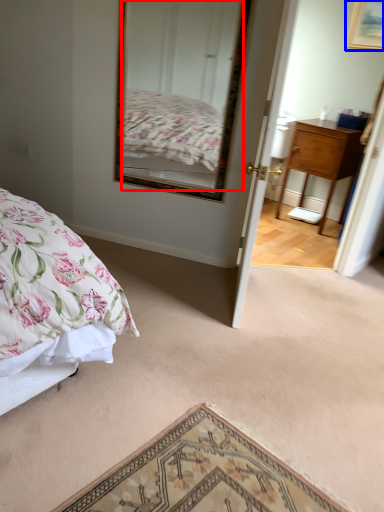
Question: Which of the following is the farthest to the observer, mirror (highlighted by a red box) or picture frame (highlighted by a blue box)?

Choices:
 (A) mirror
 (B) picture frame

Answer: (B)